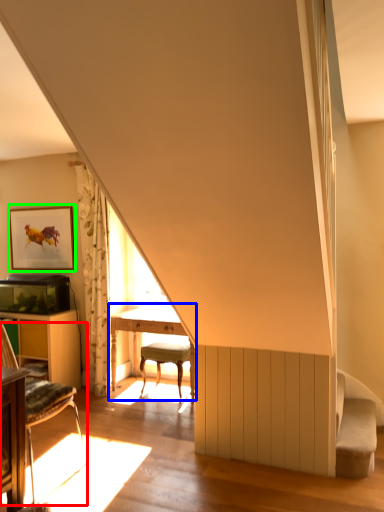
Question: Estimate the real-world distances between objects in this image. Which object is farther from chair (highlighted by a red box), table (highlighted by a blue box) or picture frame (highlighted by a green box)?

Choices:
 (A) table
 (B) picture frame

Answer: (B)